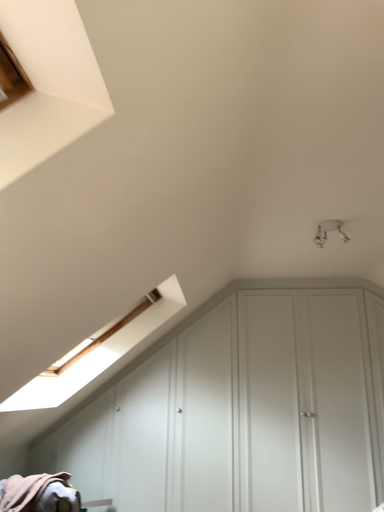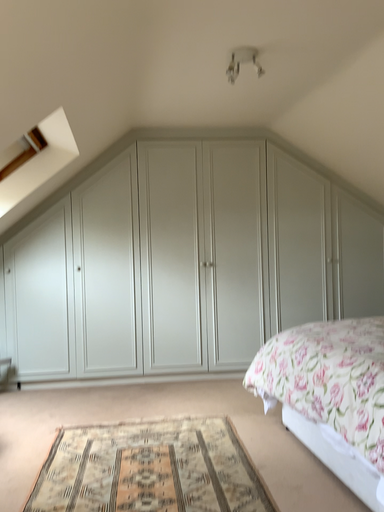
Question: How did the camera likely rotate when shooting the video?

Choices:
 (A) rotated downward
 (B) rotated upward

Answer: (A)